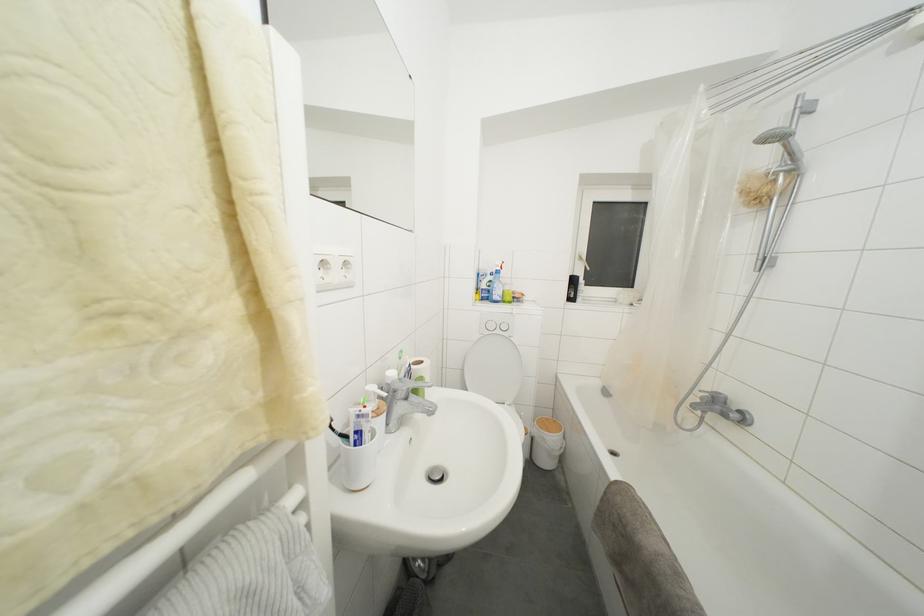
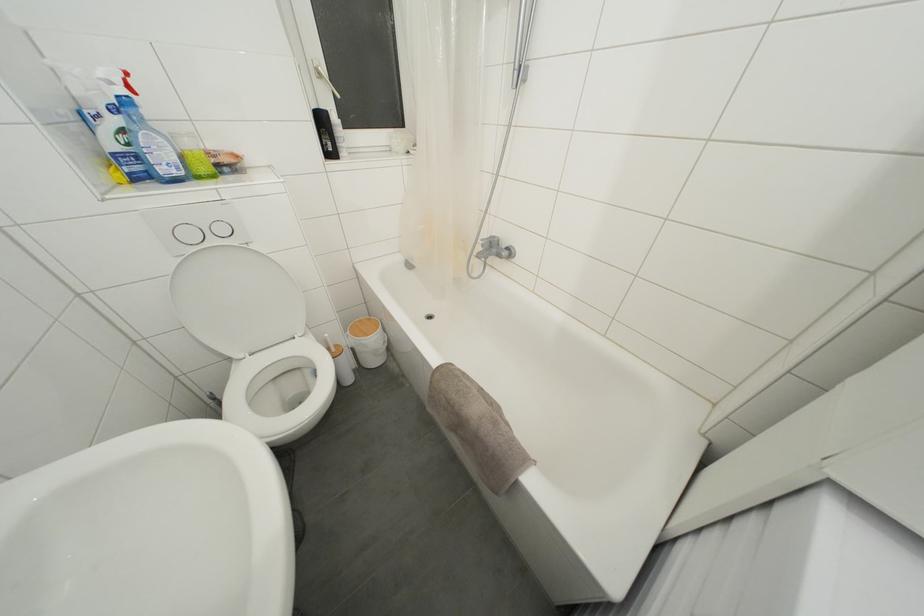
Find the pixel in the second image that matches pixel 585 264 in the first image.

(323, 79)